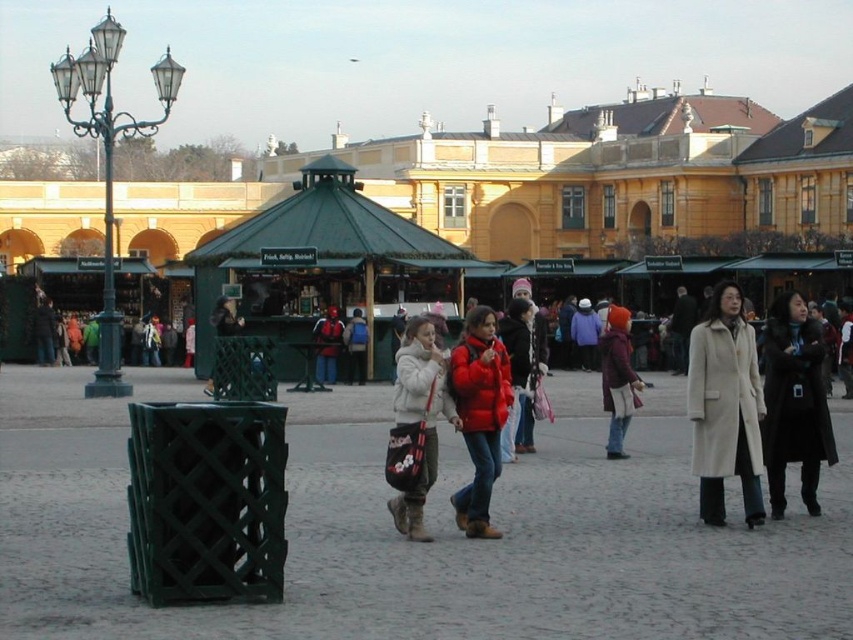
Question: Observing the image, what is the correct spatial positioning of black wool coat at center-right in reference to white fuzzy coat at center?

Choices:
 (A) below
 (B) above

Answer: (A)

Question: Is green wooden gazebo at center below beige wool coat at center?

Choices:
 (A) yes
 (B) no

Answer: (B)

Question: Among these objects, which one is farthest from the camera?

Choices:
 (A) black wool coat at center-right
 (B) white fuzzy coat at center

Answer: (A)

Question: Which point is closer to the camera taking this photo?

Choices:
 (A) (747, 499)
 (B) (779, 410)
 (C) (386, 209)

Answer: (A)

Question: Can you confirm if green wooden gazebo at center is positioned below black wool coat at center-right?

Choices:
 (A) no
 (B) yes

Answer: (A)

Question: Which of the following is the closest to the observer?

Choices:
 (A) beige wool coat at center
 (B) green wooden gazebo at center
 (C) white fuzzy coat at center
 (D) black wool coat at center-right

Answer: (C)